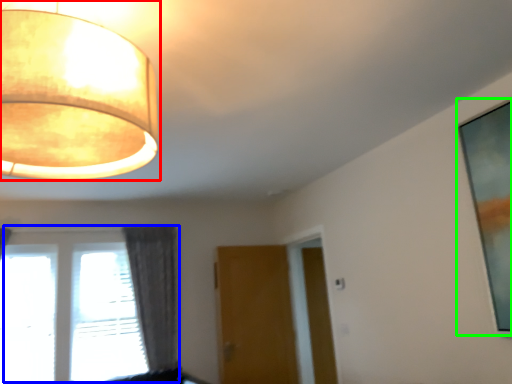
Question: Which is farther away from lamp (highlighted by a red box)? window (highlighted by a blue box) or picture frame (highlighted by a green box)?

Choices:
 (A) window
 (B) picture frame

Answer: (A)